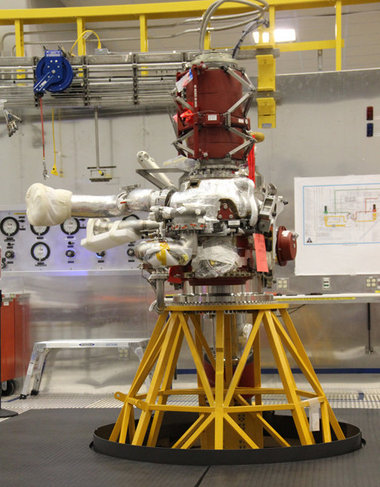
Identify the location of large white chart on wall, right center. Image resolution: width=380 pixels, height=487 pixels. (359, 225).